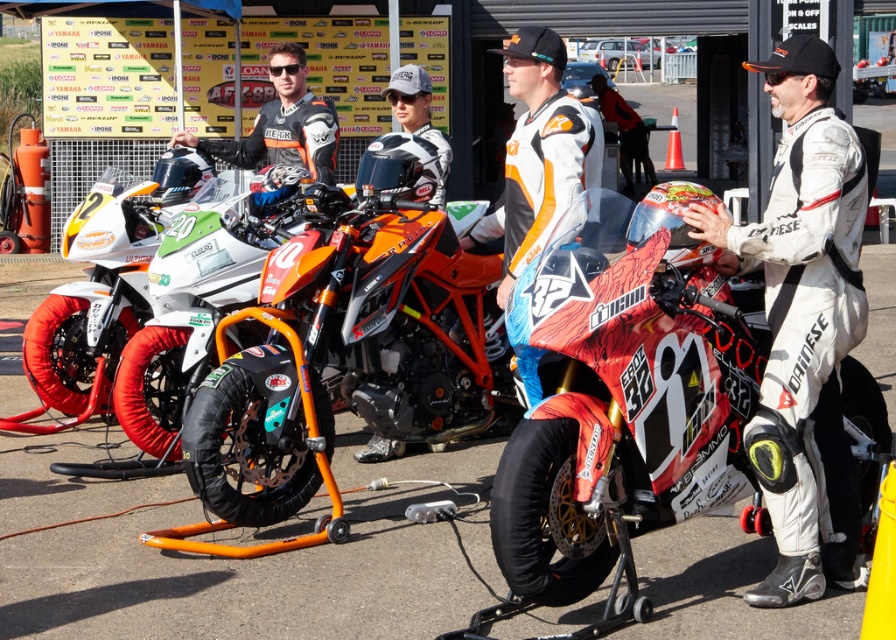
Question: Based on their relative distances, which object is farther from the orange matte motorcycle at center?

Choices:
 (A) orange and white racing suit at center
 (B) matte black jacket at center
 (C) white/textured suit at center

Answer: (C)

Question: Which point is closer to the camera?

Choices:
 (A) orange matte motorcycle at center
 (B) orange and white racing suit at center
 (C) matte black jacket at center

Answer: (B)

Question: Where is orange matte motorcycle at center located in relation to white/textured suit at center in the image?

Choices:
 (A) right
 (B) left

Answer: (B)

Question: Does orange matte motorcycle at center have a smaller size compared to white/textured suit at center?

Choices:
 (A) yes
 (B) no

Answer: (B)

Question: Is orange matte motorcycle at center thinner than matte black jacket at center?

Choices:
 (A) yes
 (B) no

Answer: (B)

Question: Among these objects, which one is farthest from the camera?

Choices:
 (A) matte black jacket at center
 (B) orange and white racing suit at center
 (C) orange matte motorcycle at center

Answer: (A)